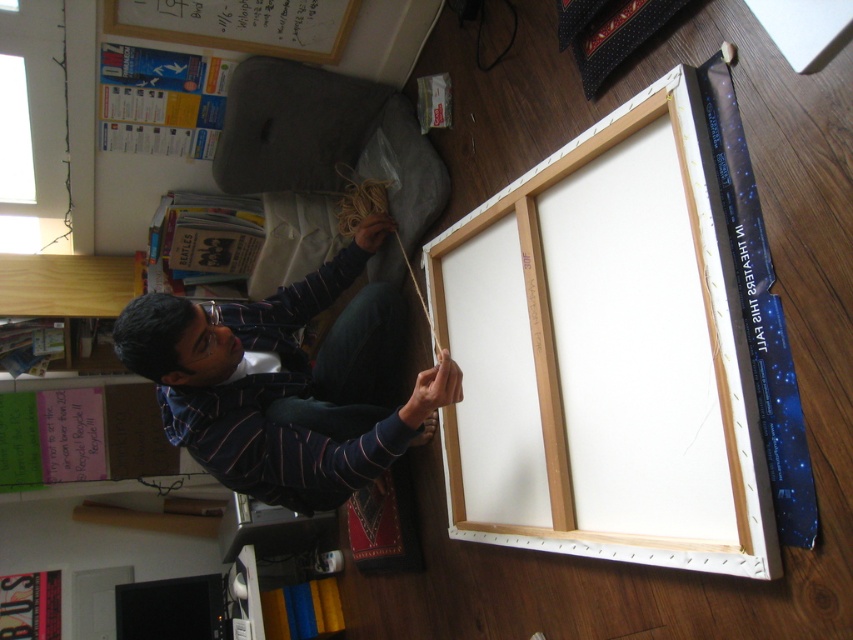
Question: Which object is farther from the camera taking this photo?

Choices:
 (A) white matte canvas at center
 (B) striped shirt at lower left

Answer: (B)

Question: Is white matte canvas at center to the left of striped shirt at lower left from the viewer's perspective?

Choices:
 (A) no
 (B) yes

Answer: (A)

Question: Is white matte canvas at center to the right of striped shirt at lower left from the viewer's perspective?

Choices:
 (A) yes
 (B) no

Answer: (A)

Question: Which of the following is the closest to the observer?

Choices:
 (A) striped shirt at lower left
 (B) white matte canvas at center

Answer: (B)

Question: Is white matte canvas at center to the left of striped shirt at lower left from the viewer's perspective?

Choices:
 (A) no
 (B) yes

Answer: (A)